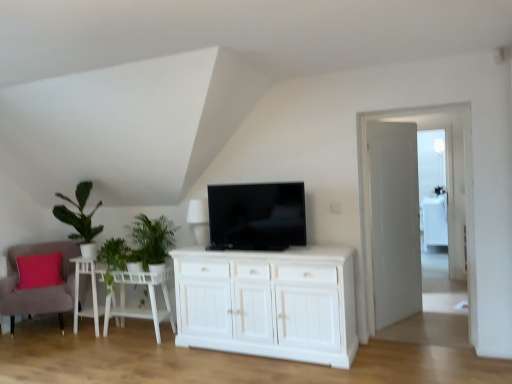
You are a GUI agent. You are given a task and a screenshot of the screen. Output one action in this format:
    pyautogui.click(x=<x>, y=<y>)
    Task: Click on the vacant space in front of transparent glass door at right, arranged as the 2th glass door when viewed from the back
    
    Given the screenshot: What is the action you would take?
    pyautogui.click(x=439, y=354)